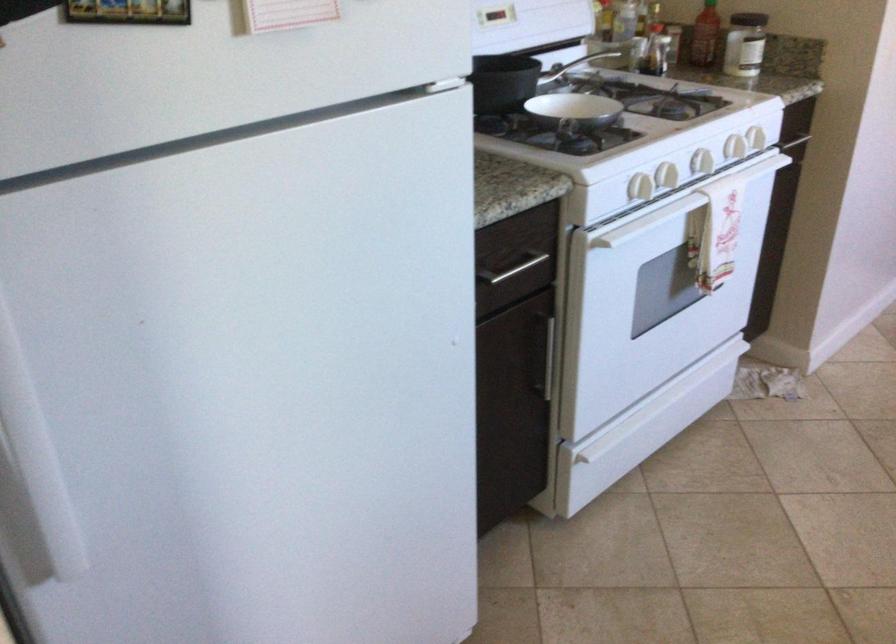
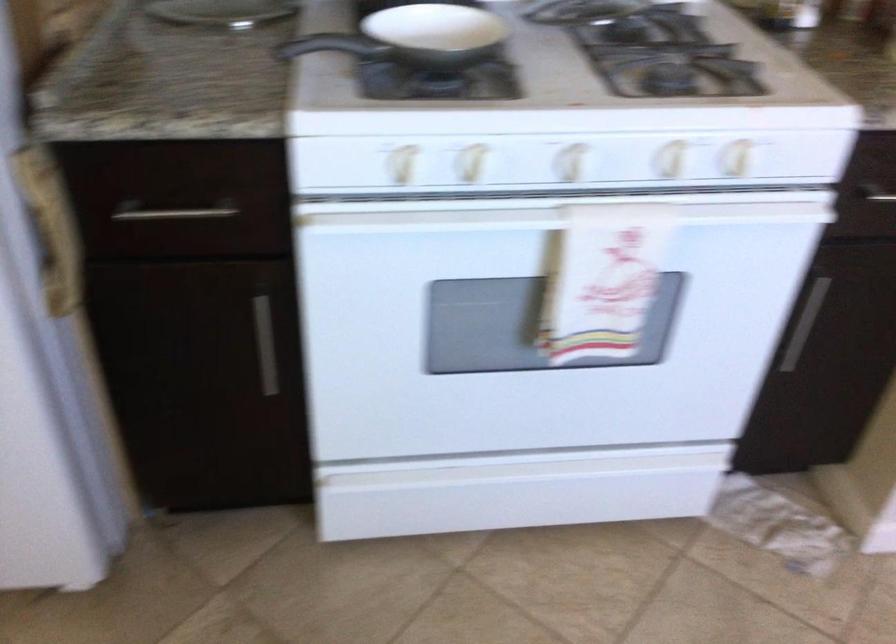
Find the pixel in the second image that matches the point at 667,144 in the first image.

(471, 163)